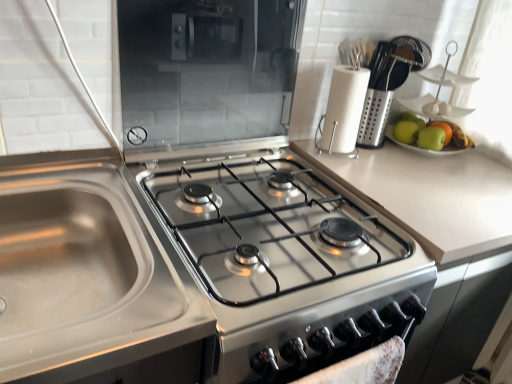
At what (x,y) coordinates should I click in order to perform the action: click on free space in front of white paper towel at upper right. Please return your answer as a coordinate pair (x, y). This screenshot has width=512, height=384. Looking at the image, I should click on (360, 170).